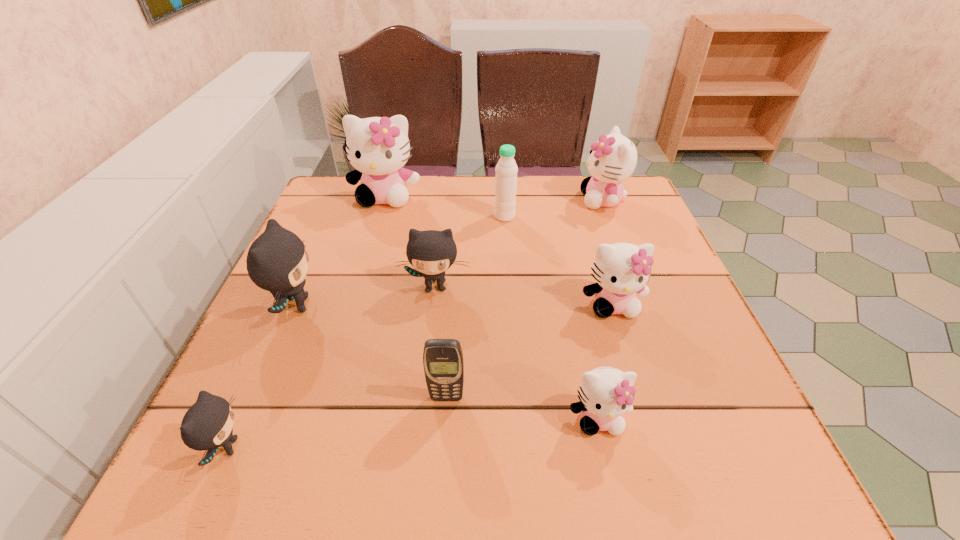
Where is `the nearest gray kitten`? the nearest gray kitten is located at coordinates (207, 425).

Find the location of a particular element. blank space located on the front-facing side of the tallest kitten is located at coordinates [357, 293].

Locate an element on the screen. The height and width of the screenshot is (540, 960). free space located 0.390m on the front-facing side of the third smallest white kitten is located at coordinates (438, 200).

I want to click on free space located 0.050m on the front-facing side of the third smallest white kitten, so click(562, 200).

The image size is (960, 540). I want to click on vacant area situated 0.200m on the front-facing side of the third smallest white kitten, so click(x=507, y=200).

Locate an element on the screen. The width and height of the screenshot is (960, 540). vacant space located 0.290m on the left of the sixth object from left to right is located at coordinates (383, 217).

Identify the location of free space located 0.200m on the front-facing side of the biggest gray kitten. Image resolution: width=960 pixels, height=540 pixels. (417, 306).

Image resolution: width=960 pixels, height=540 pixels. What are the coordinates of `free space located 0.320m on the front-facing side of the third farthest white kitten` in the screenshot? It's located at (669, 486).

I want to click on vacant region located on the front-facing side of the second smallest gray kitten, so click(x=427, y=362).

At what (x,y) coordinates should I click in order to perform the action: click on vacant space situated 0.130m on the screen of the cellular telephone. Please return your answer as a coordinate pair (x, y). The height and width of the screenshot is (540, 960). Looking at the image, I should click on (442, 479).